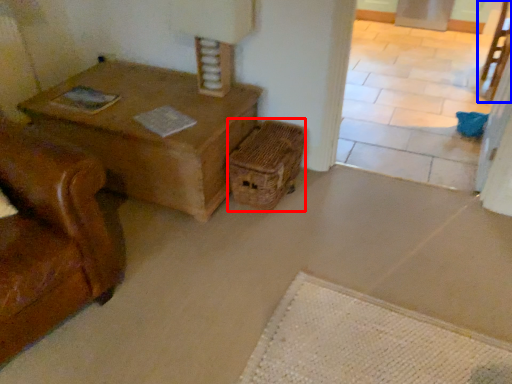
Question: Which point is further to the camera, crate (highlighted by a red box) or chair (highlighted by a blue box)?

Choices:
 (A) crate
 (B) chair

Answer: (B)